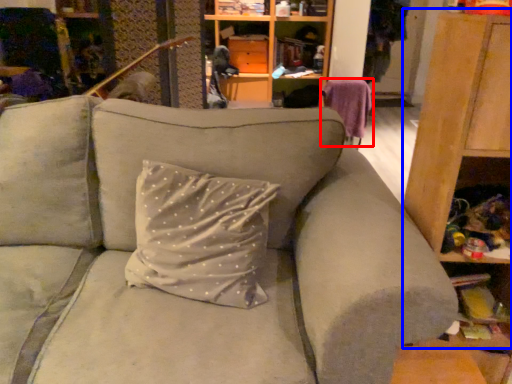
Question: Which point is closer to the camera, swivel chair (highlighted by a red box) or dresser (highlighted by a blue box)?

Choices:
 (A) swivel chair
 (B) dresser

Answer: (B)